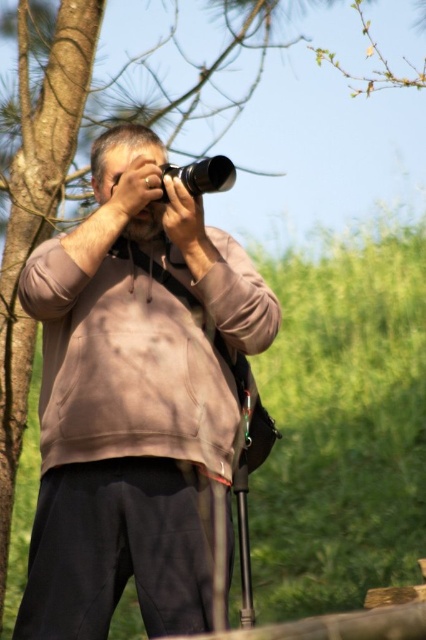
Question: Considering the relative positions of brown cotton hoodie at center and metallic silver camera at center in the image provided, where is brown cotton hoodie at center located with respect to metallic silver camera at center?

Choices:
 (A) above
 (B) below

Answer: (B)

Question: Among these objects, which one is farthest from the camera?

Choices:
 (A) metallic silver camera at center
 (B) brown cotton hoodie at center

Answer: (B)

Question: Can you confirm if brown cotton hoodie at center is bigger than metallic silver camera at center?

Choices:
 (A) yes
 (B) no

Answer: (A)

Question: Among these points, which one is farthest from the camera?

Choices:
 (A) (195, 196)
 (B) (209, 499)

Answer: (B)

Question: Does brown cotton hoodie at center lie behind metallic silver camera at center?

Choices:
 (A) no
 (B) yes

Answer: (B)